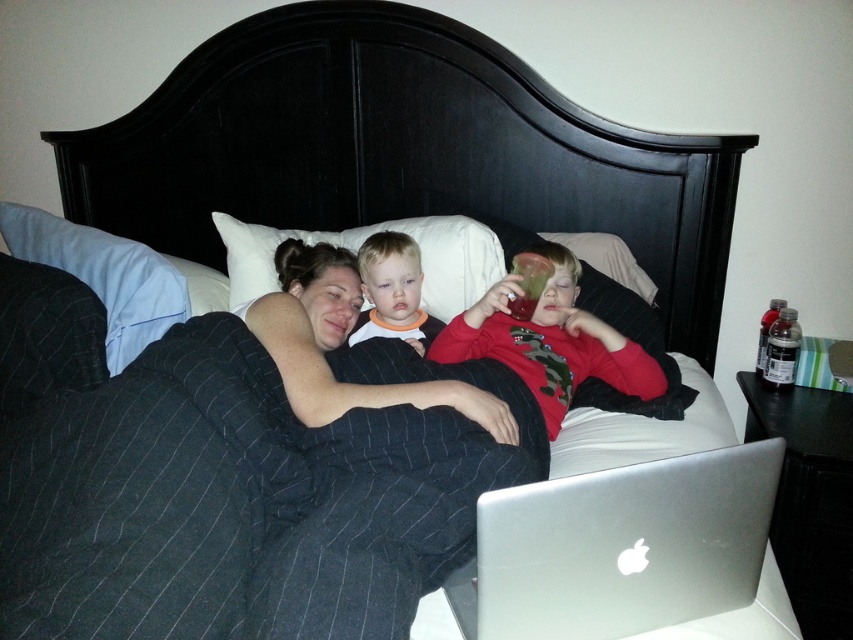
You are a delivery robot that needs to place a small package between the silver metallic laptop at lower right and the white soft pillow at center. The package is 1 meter long. Will it fit in the space between them?

Result: The distance between the silver metallic laptop at lower right and the white soft pillow at center is 95.42 centimeters. Since the package is 1 meter long, which is longer than the available space, it will not fit between them.

You are standing in the room where the scene is taking place. You want to place a new object at the same location as the silver metallic laptop at lower right. What are the coordinates of that location?

The coordinates of the silver metallic laptop at lower right are at point (619, 547).

You are a photographer setting up a shoot in this scene. You need to ensure that both the matte black blanket at center and the red matte shirt at center are fully visible in the frame. Given their sizes, which object might require you to adjust your camera angle to accommodate its height?

The matte black blanket at center is much taller than the red matte shirt at center, so you might need to adjust the camera angle to ensure it fits within the frame.